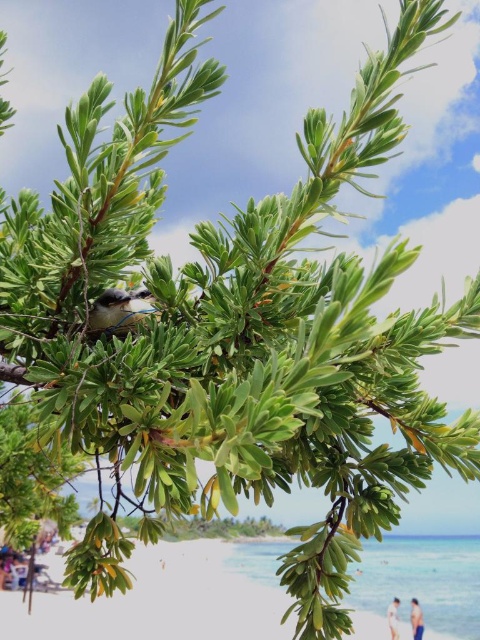
Does soft brown feathers at center have a greater height compared to light blue skin at lower right?

In fact, soft brown feathers at center may be shorter than light blue skin at lower right.

Is point (136, 316) closer to viewer compared to point (422, 627)?

That is True.

Is point (127, 320) farther from viewer compared to point (417, 612)?

No, (127, 320) is closer to viewer.

At what (x,y) coordinates should I click in order to perform the action: click on soft brown feathers at center. Please return your answer as a coordinate pair (x, y). Looking at the image, I should click on (115, 310).

Is light blue skin at lower right above white cotton shirt at lower right?

Indeed, light blue skin at lower right is positioned over white cotton shirt at lower right.

This screenshot has height=640, width=480. Describe the element at coordinates (416, 620) in the screenshot. I see `light blue skin at lower right` at that location.

What do you see at coordinates (416, 620) in the screenshot? The width and height of the screenshot is (480, 640). I see `light blue skin at lower right` at bounding box center [416, 620].

Where is `light blue skin at lower right`? Image resolution: width=480 pixels, height=640 pixels. light blue skin at lower right is located at coordinates (416, 620).

Is white sand beach at lower left to the right of white cotton shirt at lower right from the viewer's perspective?

Incorrect, white sand beach at lower left is not on the right side of white cotton shirt at lower right.

Which is above, white sand beach at lower left or white cotton shirt at lower right?

white sand beach at lower left is above.

This screenshot has height=640, width=480. What do you see at coordinates (168, 598) in the screenshot? I see `white sand beach at lower left` at bounding box center [168, 598].

In order to click on white sand beach at lower left in this screenshot , I will do `click(168, 598)`.